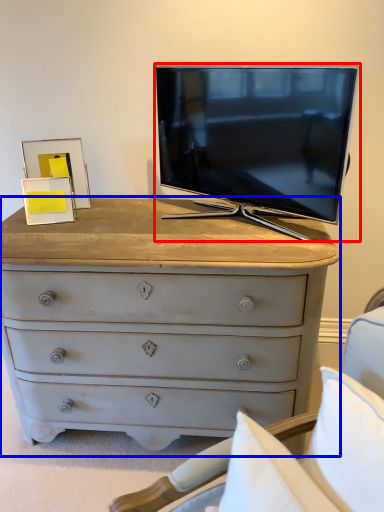
Question: Which of the following is the farthest to the observer, television (highlighted by a red box) or chest of drawers (highlighted by a blue box)?

Choices:
 (A) television
 (B) chest of drawers

Answer: (A)